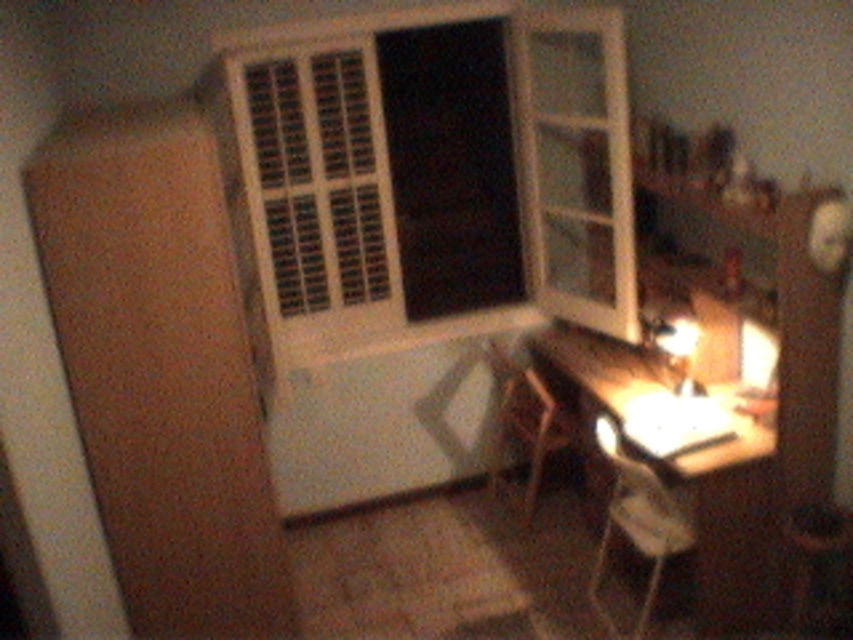
Is wooden desk at lower right closer to the viewer compared to wooden stool at lower right?

No, wooden desk at lower right is behind wooden stool at lower right.

Who is positioned more to the right, wooden desk at lower right or wooden stool at lower right?

wooden stool at lower right

Is point (689, 513) positioned after point (804, 532)?

Yes, point (689, 513) is behind point (804, 532).

The width and height of the screenshot is (853, 640). Find the location of `wooden desk at lower right`. wooden desk at lower right is located at coordinates (657, 458).

Who is higher up, wooden desk at lower right or white glossy lamp at lower right?

white glossy lamp at lower right is higher up.

Is point (645, 609) positioned in front of point (654, 316)?

Yes.

Describe the element at coordinates (657, 458) in the screenshot. I see `wooden desk at lower right` at that location.

Locate an element on the screen. wooden desk at lower right is located at coordinates (657, 458).

Can you confirm if wooden desk at lower right is thinner than white plastic chair at lower right?

No.

Between wooden desk at lower right and white plastic chair at lower right, which one appears on the left side from the viewer's perspective?

From the viewer's perspective, wooden desk at lower right appears more on the left side.

Is point (601, 429) positioned after point (648, 596)?

Yes, it is.

Locate an element on the screen. wooden desk at lower right is located at coordinates (657, 458).